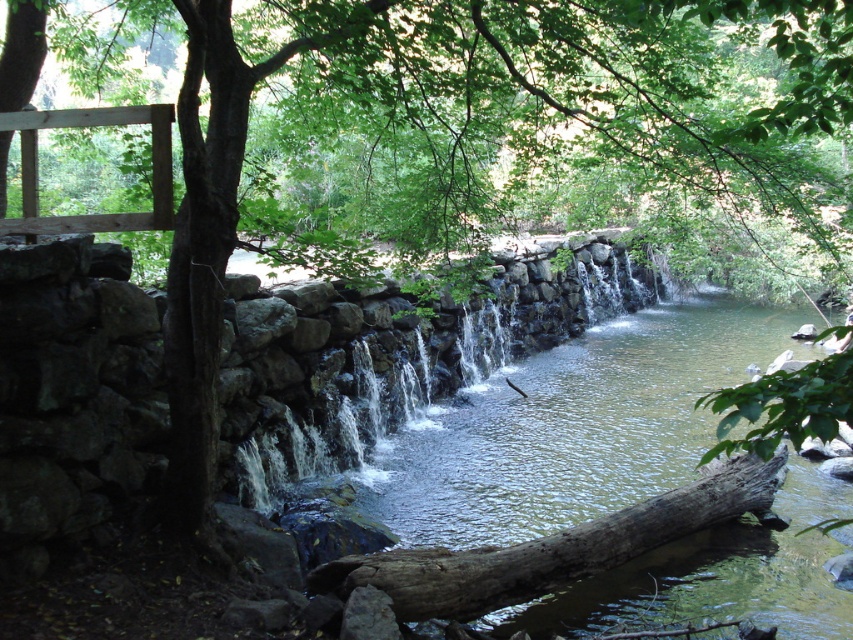
Which is above, clear stone waterfall at center or brown rough log at center?

clear stone waterfall at center

Is clear stone waterfall at center to the right of brown rough log at center from the viewer's perspective?

Yes, clear stone waterfall at center is to the right of brown rough log at center.

Between point (308, 285) and point (463, 593), which one is positioned in front?

Positioned in front is point (463, 593).

In order to click on clear stone waterfall at center in this screenshot , I will do `click(393, 356)`.